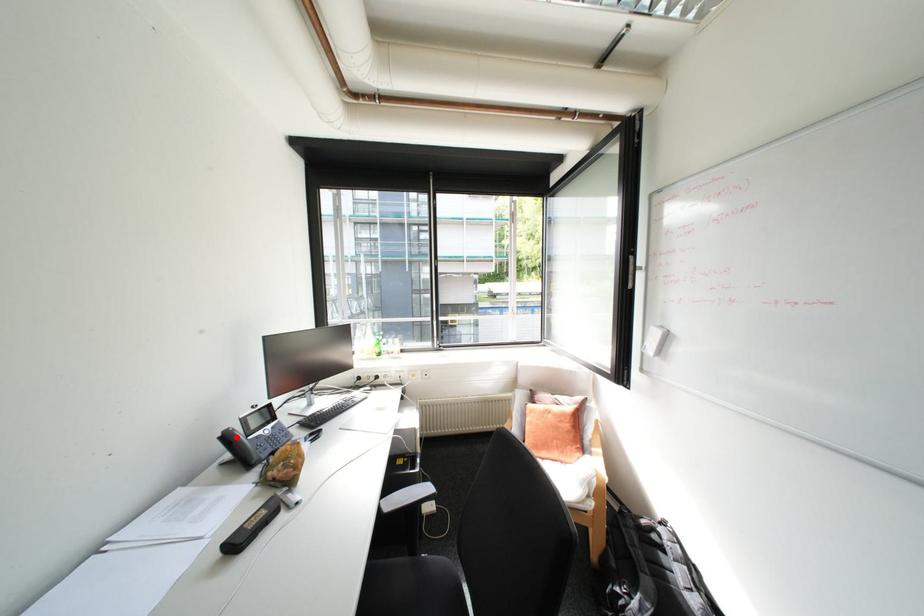
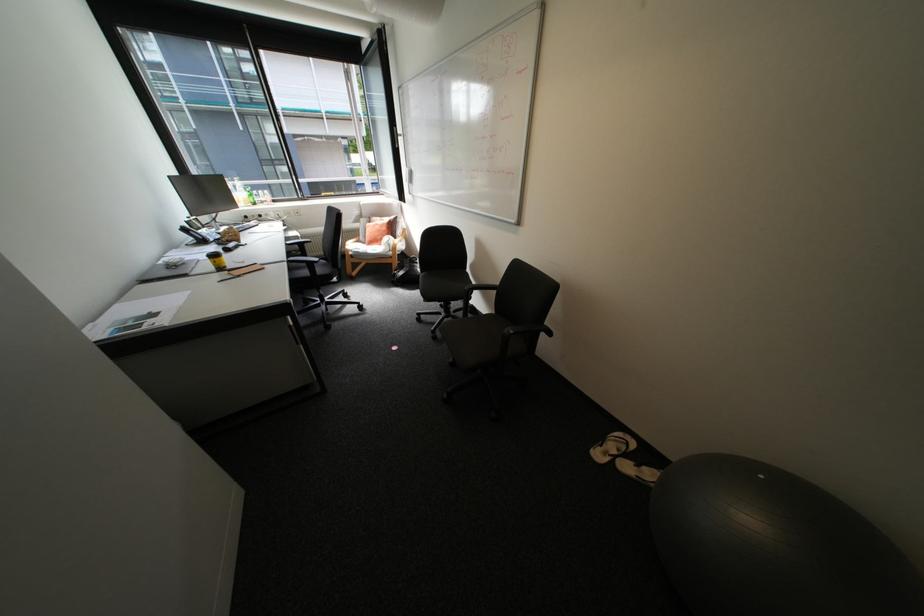
Question: I am providing you with two images of the same scene from different viewpoints. A red point is marked on the first image. Can you still see the location of the red point in image 2?

Choices:
 (A) Yes
 (B) No

Answer: (A)